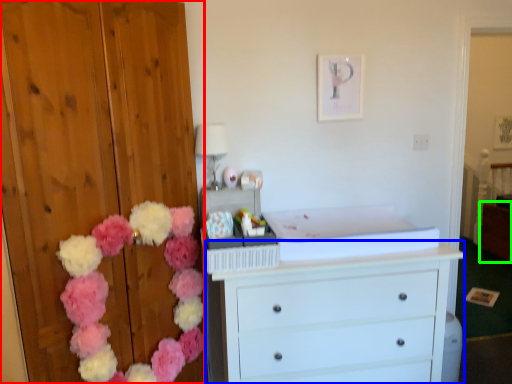
Question: Considering the real-world distances, which object is closest to dresser (highlighted by a red box)? chest of drawers (highlighted by a blue box) or cabinetry (highlighted by a green box).

Choices:
 (A) chest of drawers
 (B) cabinetry

Answer: (A)